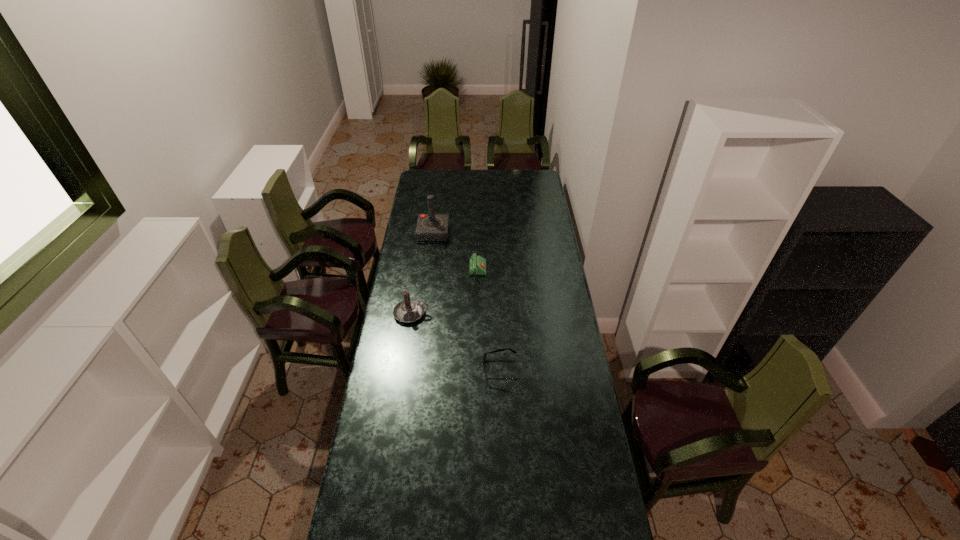
The image size is (960, 540). In order to click on the tallest object in this screenshot , I will do `click(430, 227)`.

The width and height of the screenshot is (960, 540). What are the coordinates of `the farthest object` in the screenshot? It's located at (430, 227).

Identify the location of the second nearest object. (409, 310).

This screenshot has height=540, width=960. Find the location of `the second tallest object`. the second tallest object is located at coordinates (409, 310).

Locate an element on the screen. the second shortest object is located at coordinates (477, 265).

You are a GUI agent. You are given a task and a screenshot of the screen. Output one action in this format:
    pyautogui.click(x=<x>, y=<y>)
    Task: Click on the second farthest object
    Image resolution: width=960 pixels, height=540 pixels.
    Given the screenshot: What is the action you would take?
    pyautogui.click(x=477, y=265)

The image size is (960, 540). Find the location of `the shortest object`. the shortest object is located at coordinates [x=484, y=357].

The image size is (960, 540). In order to click on the nearest object in this screenshot , I will do click(484, 357).

Locate an element on the screen. vacant space located 0.360m on the rectangular base of the joystick is located at coordinates [426, 288].

You are a GUI agent. You are given a task and a screenshot of the screen. Output one action in this format:
    pyautogui.click(x=<x>, y=<y>)
    Task: Click on the free space located 0.350m on the side of the candle with the handle loop
    Image resolution: width=960 pixels, height=540 pixels.
    Given the screenshot: What is the action you would take?
    pyautogui.click(x=506, y=313)